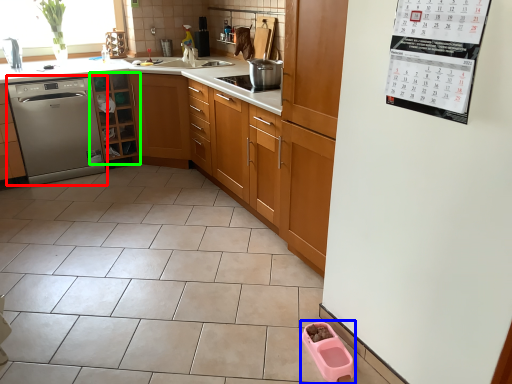
Question: Which object is positioned closest to dishwasher (highlighted by a red box)? Select from appliance (highlighted by a blue box) and cabinetry (highlighted by a green box).

Choices:
 (A) appliance
 (B) cabinetry

Answer: (B)